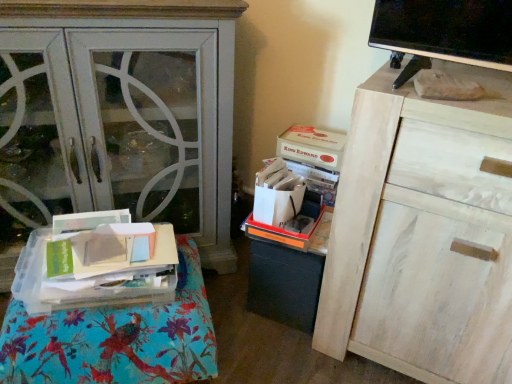
Question: Looking at their shapes, would you say white wood cabinet at upper right is wider or thinner than orange plastic storage box at center, which is counted as the 2th storage box, starting from the top?

Choices:
 (A) wide
 (B) thin

Answer: (A)

Question: Does point (493, 337) appear closer or farther from the camera than point (311, 205)?

Choices:
 (A) closer
 (B) farther

Answer: (A)

Question: Which object is positioned farthest from the matte white cabinet at left?

Choices:
 (A) white wood cabinet at upper right
 (B) clear plastic tray at lower left
 (C) white cardboard box at upper center, placed as the second storage box when sorted from bottom to top
 (D) orange plastic storage box at center, which is the 1th storage box from bottom to top

Answer: (A)

Question: Which object is positioned closest to the clear plastic tray at lower left?

Choices:
 (A) white wood cabinet at upper right
 (B) matte white cabinet at left
 (C) white cardboard box at upper center, placed as the second storage box when sorted from bottom to top
 (D) orange plastic storage box at center, which is counted as the 2th storage box, starting from the top

Answer: (D)